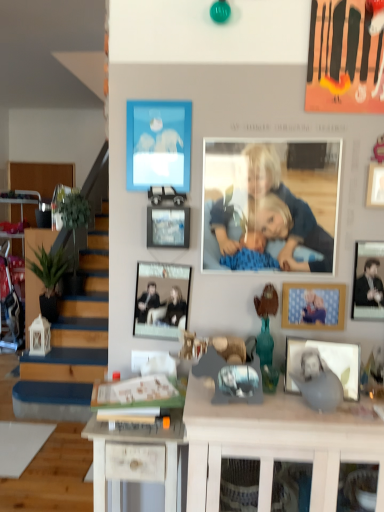
Question: Is white wood desk at center, acting as the first desk starting from the left, in front of matte blue picture frame at upper center, the first picture frame positioned from the top?

Choices:
 (A) yes
 (B) no

Answer: (A)

Question: Could matte blue picture frame at upper center, positioned as the 5th picture frame in bottom-to-top order, be considered to be inside white wood desk at center, which ranks as the second desk in right-to-left order?

Choices:
 (A) no
 (B) yes

Answer: (A)

Question: Considering the relative sizes of white wood desk at center, which ranks as the second desk in right-to-left order, and matte blue picture frame at upper center, positioned as the 5th picture frame in bottom-to-top order, in the image provided, is white wood desk at center, which ranks as the second desk in right-to-left order, bigger than matte blue picture frame at upper center, positioned as the 5th picture frame in bottom-to-top order,?

Choices:
 (A) yes
 (B) no

Answer: (A)

Question: Can you confirm if white wood desk at center, which ranks as the second desk in right-to-left order, is thinner than matte blue picture frame at upper center, positioned as the 5th picture frame in bottom-to-top order?

Choices:
 (A) no
 (B) yes

Answer: (A)

Question: Would you consider white wood desk at center, which ranks as the second desk in right-to-left order, to be distant from matte blue picture frame at upper center, the first picture frame positioned from the top?

Choices:
 (A) yes
 (B) no

Answer: (B)

Question: Can you confirm if white wood desk at center, acting as the first desk starting from the left, is taller than matte blue picture frame at upper center, the first picture frame positioned from the top?

Choices:
 (A) yes
 (B) no

Answer: (A)

Question: Would you consider white wood desk at center, the 2th desk viewed from the left, to be distant from green matte plant at left?

Choices:
 (A) no
 (B) yes

Answer: (B)

Question: Considering the relative sizes of white wood desk at center, positioned as the first desk in right-to-left order, and green matte plant at left in the image provided, is white wood desk at center, positioned as the first desk in right-to-left order, bigger than green matte plant at left?

Choices:
 (A) no
 (B) yes

Answer: (B)

Question: Would you say green matte plant at left is part of white wood desk at center, positioned as the first desk in right-to-left order,'s contents?

Choices:
 (A) yes
 (B) no

Answer: (B)

Question: Can you confirm if white wood desk at center, positioned as the first desk in right-to-left order, is thinner than green matte plant at left?

Choices:
 (A) yes
 (B) no

Answer: (B)

Question: Is white wood desk at center, the 2th desk viewed from the left, next to green matte plant at left and touching it?

Choices:
 (A) yes
 (B) no

Answer: (B)

Question: From the image's perspective, is white wood desk at center, positioned as the first desk in right-to-left order, below green matte plant at left?

Choices:
 (A) no
 (B) yes

Answer: (B)

Question: Can you confirm if metallic black picture frame at center, the fourth picture frame in the bottom-to-top sequence, is smaller than wooden picture frame at center-right, the 4th picture frame from the top?

Choices:
 (A) no
 (B) yes

Answer: (A)